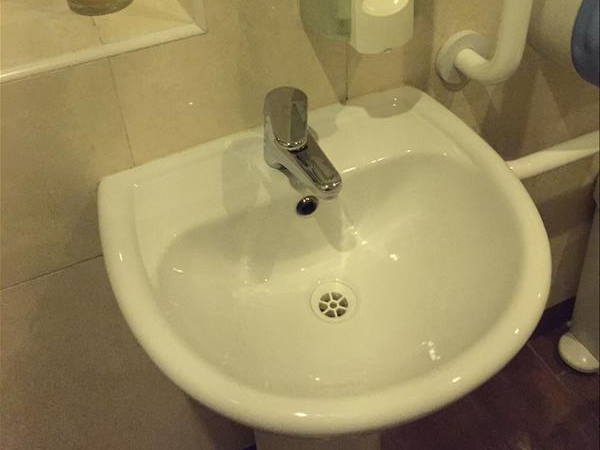
At what (x,y) coordinates should I click in order to perform the action: click on soap. Please return your answer as a coordinate pair (x, y). Looking at the image, I should click on (365, 36).